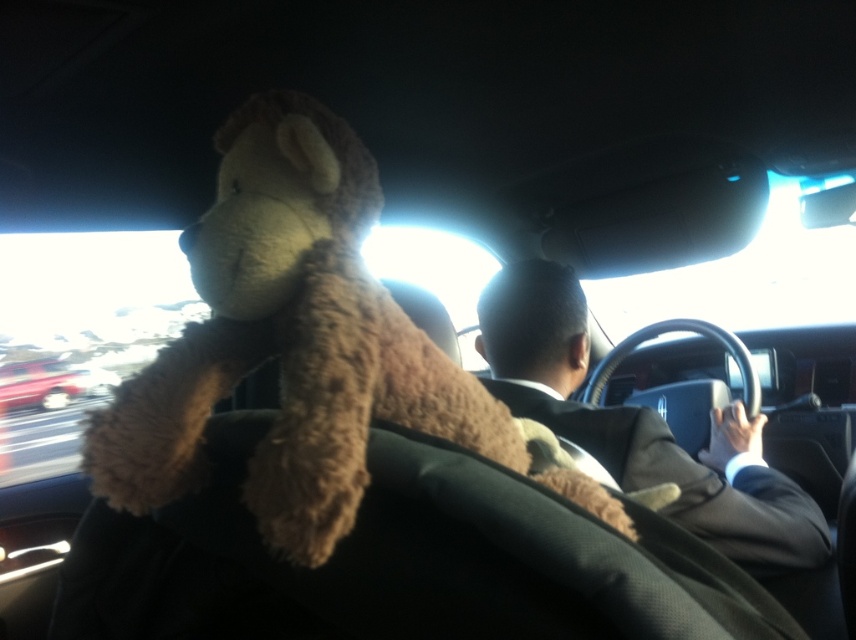
You are sitting in the passenger seat of a car and notice a brown plush toy at center. If you want to grab it without moving your seat, can you reach it?

The brown plush toy at center is 20.73 inches away from you, so yes, you can reach it since the average arm length is about 25 inches.

Looking at this image, you are sitting in the passenger seat of the car. You notice two points marked on the windshield. The first point is at coordinates point (413, 332) and the second point is at point (535, 355). From your perspective, which point is closer to you?

Point (413, 332) is in front of point (535, 355), so it is closer to you.

You are sitting in the passenger seat of the car and notice the dark brown suit at center and the metallic red car at left. Which object is taller?

The dark brown suit at center is taller than the metallic red car at left.